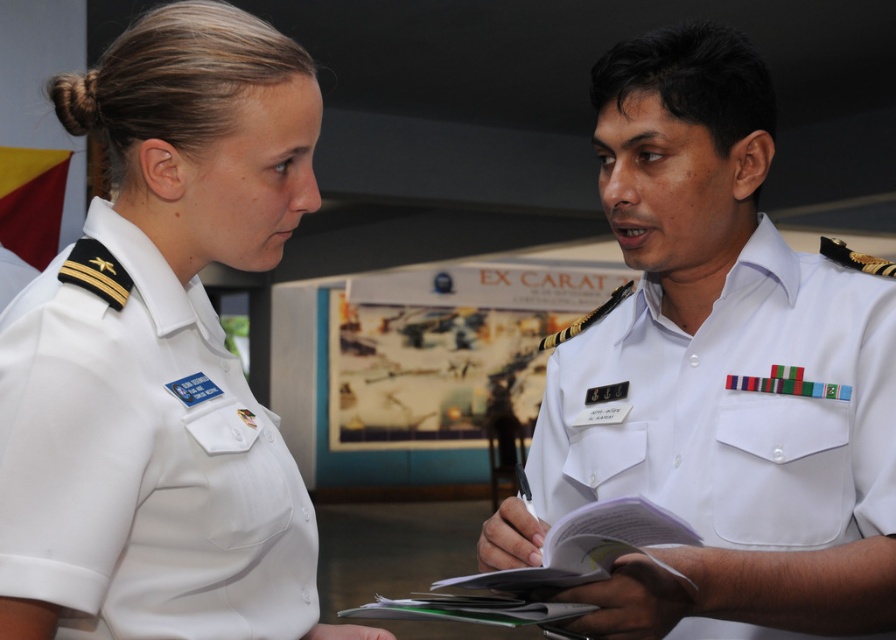
Question: Can you confirm if white uniform at right is smaller than white cotton shirt at upper left?

Choices:
 (A) yes
 (B) no

Answer: (B)

Question: Among these points, which one is nearest to the camera?

Choices:
 (A) (648, 312)
 (B) (313, 620)

Answer: (B)

Question: Is white uniform at right to the left of white cotton shirt at upper left from the viewer's perspective?

Choices:
 (A) yes
 (B) no

Answer: (B)

Question: Can you confirm if white uniform at right is positioned above white cotton shirt at upper left?

Choices:
 (A) no
 (B) yes

Answer: (B)

Question: Which of the following is the closest to the observer?

Choices:
 (A) white cotton shirt at upper left
 (B) white uniform at right

Answer: (A)

Question: Among these objects, which one is nearest to the camera?

Choices:
 (A) white cotton shirt at upper left
 (B) white uniform at right

Answer: (A)